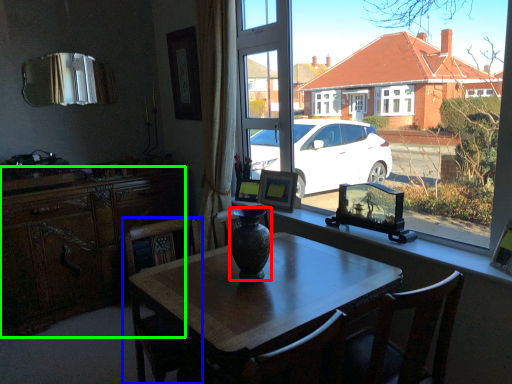
Question: Estimate the real-world distances between objects in this image. Which object is farther from vase (highlighted by a red box), chair (highlighted by a blue box) or cabinetry (highlighted by a green box)?

Choices:
 (A) chair
 (B) cabinetry

Answer: (B)